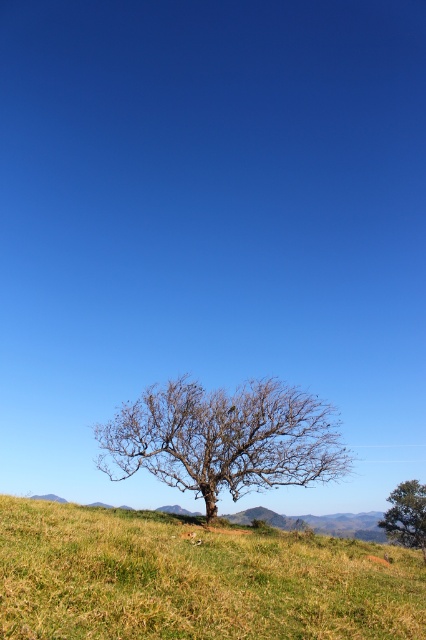
Does bare branches at center have a lesser width compared to green leafy tree at center?

No.

Who is positioned more to the left, bare branches at center or green leafy tree at center?

bare branches at center

Locate an element on the screen. bare branches at center is located at coordinates (224, 438).

Between green grassy hillside at lower center and green leafy tree at center, which one is positioned higher?

green grassy hillside at lower center

Which is more to the right, green grassy hillside at lower center or green leafy tree at center?

Positioned to the right is green leafy tree at center.

Identify the location of green grassy hillside at lower center. Image resolution: width=426 pixels, height=640 pixels. (193, 579).

Can you confirm if green grassy hillside at lower center is wider than bare branches at center?

Yes.

Can you confirm if green grassy hillside at lower center is positioned above bare branches at center?

Actually, green grassy hillside at lower center is below bare branches at center.

Image resolution: width=426 pixels, height=640 pixels. Find the location of `green grassy hillside at lower center`. green grassy hillside at lower center is located at coordinates (193, 579).